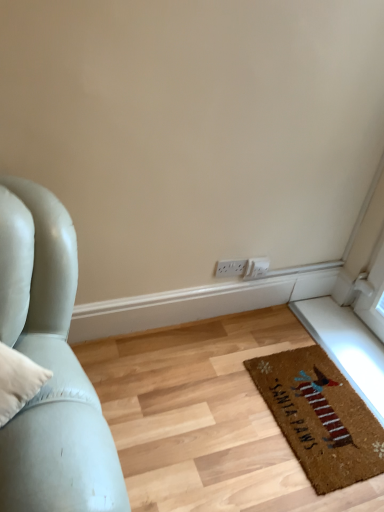
Measure the distance between point (304, 463) and camera.

Point (304, 463) is 1.45 meters from camera.

What are the coordinates of `brown coir mat at lower right` in the screenshot? It's located at (320, 417).

Describe the element at coordinates (320, 417) in the screenshot. This screenshot has width=384, height=512. I see `brown coir mat at lower right` at that location.

The image size is (384, 512). I want to click on white plastic electric outlet at center, so click(230, 268).

What do you see at coordinates (230, 268) in the screenshot? The width and height of the screenshot is (384, 512). I see `white plastic electric outlet at center` at bounding box center [230, 268].

Identify the location of brown coir mat at lower right. (320, 417).

Visually, is white plastic electric outlet at center positioned to the left or to the right of brown coir mat at lower right?

white plastic electric outlet at center is to the left of brown coir mat at lower right.

Is white plastic electric outlet at center in front of or behind brown coir mat at lower right in the image?

Clearly, white plastic electric outlet at center is behind brown coir mat at lower right.

Is point (235, 264) closer to camera compared to point (344, 471)?

No, (235, 264) is further to viewer.

From the image's perspective, would you say white plastic electric outlet at center is positioned over brown coir mat at lower right?

Indeed, from the image's perspective, white plastic electric outlet at center is shown above brown coir mat at lower right.

From a real-world perspective, is white plastic electric outlet at center on top of brown coir mat at lower right?

Correct, in the physical world, white plastic electric outlet at center is higher than brown coir mat at lower right.

Which object is wider, white plastic electric outlet at center or brown coir mat at lower right?

Wider between the two is brown coir mat at lower right.

Who is shorter, white plastic electric outlet at center or brown coir mat at lower right?

brown coir mat at lower right.

Considering the relative sizes of white plastic electric outlet at center and brown coir mat at lower right in the image provided, is white plastic electric outlet at center smaller than brown coir mat at lower right?

Correct, white plastic electric outlet at center occupies less space than brown coir mat at lower right.

Is white plastic electric outlet at center situated inside brown coir mat at lower right or outside?

white plastic electric outlet at center cannot be found inside brown coir mat at lower right.

Consider the image. Is white plastic electric outlet at center far from brown coir mat at lower right?

white plastic electric outlet at center is actually quite close to brown coir mat at lower right.

Does white plastic electric outlet at center turn towards brown coir mat at lower right?

No, white plastic electric outlet at center is not aimed at brown coir mat at lower right.

Locate an element on the screen. This screenshot has height=512, width=384. electric outlet lying on the left of brown coir mat at lower right is located at coordinates (230, 268).

Is brown coir mat at lower right to the left of white plastic electric outlet at center from the viewer's perspective?

No.

Which is behind, brown coir mat at lower right or white plastic electric outlet at center?

Positioned behind is white plastic electric outlet at center.

Does point (265, 370) lie behind point (238, 267)?

No, it is in front of (238, 267).

From the image's perspective, is brown coir mat at lower right above or below white plastic electric outlet at center?

From the image's perspective, brown coir mat at lower right appears below white plastic electric outlet at center.

From a real-world perspective, does brown coir mat at lower right stand above white plastic electric outlet at center?

No, from a real-world perspective, brown coir mat at lower right is not over white plastic electric outlet at center

Considering the sizes of objects brown coir mat at lower right and white plastic electric outlet at center in the image provided, who is thinner, brown coir mat at lower right or white plastic electric outlet at center?

white plastic electric outlet at center.

Can you confirm if brown coir mat at lower right is taller than white plastic electric outlet at center?

Incorrect, the height of brown coir mat at lower right is not larger of that of white plastic electric outlet at center.

Is brown coir mat at lower right bigger than white plastic electric outlet at center?

Yes.

Based on the photo, can white plastic electric outlet at center be found inside brown coir mat at lower right?

No, brown coir mat at lower right does not contain white plastic electric outlet at center.

Is brown coir mat at lower right not near white plastic electric outlet at center?

Actually, brown coir mat at lower right and white plastic electric outlet at center are a little close together.

Is brown coir mat at lower right facing towards white plastic electric outlet at center?

No.

How different are the orientations of brown coir mat at lower right and white plastic electric outlet at center in degrees?

The angular difference between brown coir mat at lower right and white plastic electric outlet at center is 90 degrees.

The height and width of the screenshot is (512, 384). Identify the location of mat on the right of white plastic electric outlet at center. (320, 417).

In the image, there is a white plastic electric outlet at center. Where is `mat below it (from the image's perspective)`? This screenshot has height=512, width=384. mat below it (from the image's perspective) is located at coordinates (320, 417).

Where is `electric outlet on the left of brown coir mat at lower right`? The height and width of the screenshot is (512, 384). electric outlet on the left of brown coir mat at lower right is located at coordinates (230, 268).